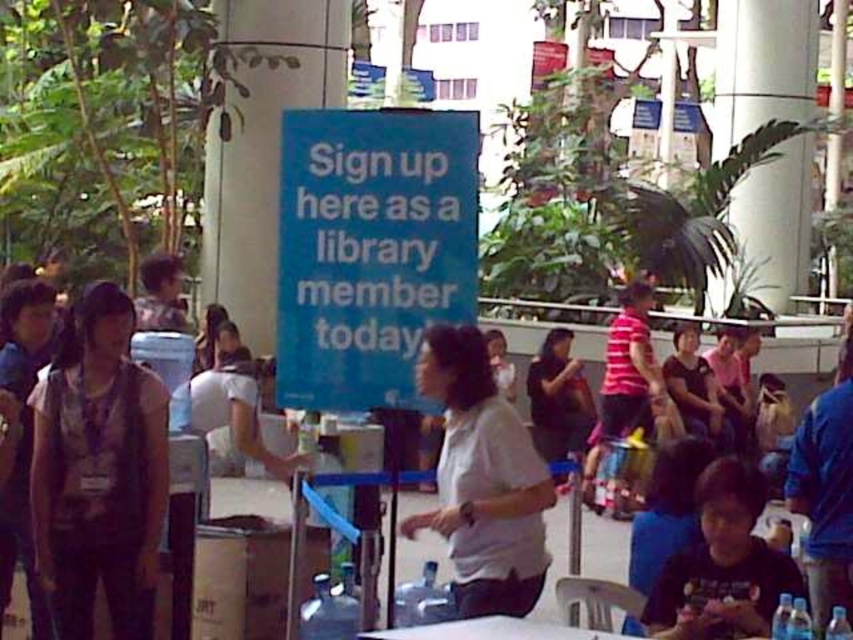
You are a visitor at the library and want to sign up for a membership. You see the blue paper sign at center and the white matte shirt at center. Which object is located to the left of the other?

The blue paper sign at center is positioned on the left side of white matte shirt at center, so the blue paper sign at center is to the left of the white matte shirt at center.

You are a visitor at the library and need to sign up for a membership. You are standing near the white matte shirt at center. Can you reach the blue paper sign at center without moving your position?

The distance between the blue paper sign at center and the white matte shirt at center is 4.97 feet. Since you are standing near the white matte shirt at center, you would need to move approximately 5 feet to reach the blue paper sign at center, so you cannot reach it without moving.

You are standing in the library and see two people wearing the black matte shirt at lower right and the dark gray shirt at center. Which person is positioned more to the right side of the scene?

The black matte shirt at lower right is positioned more to the right side of the scene compared to the dark gray shirt at center.